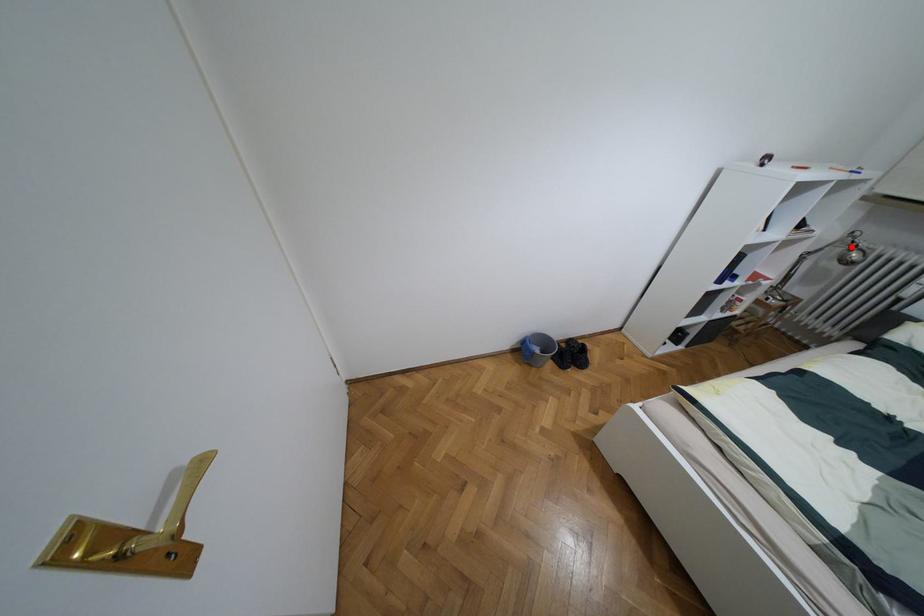
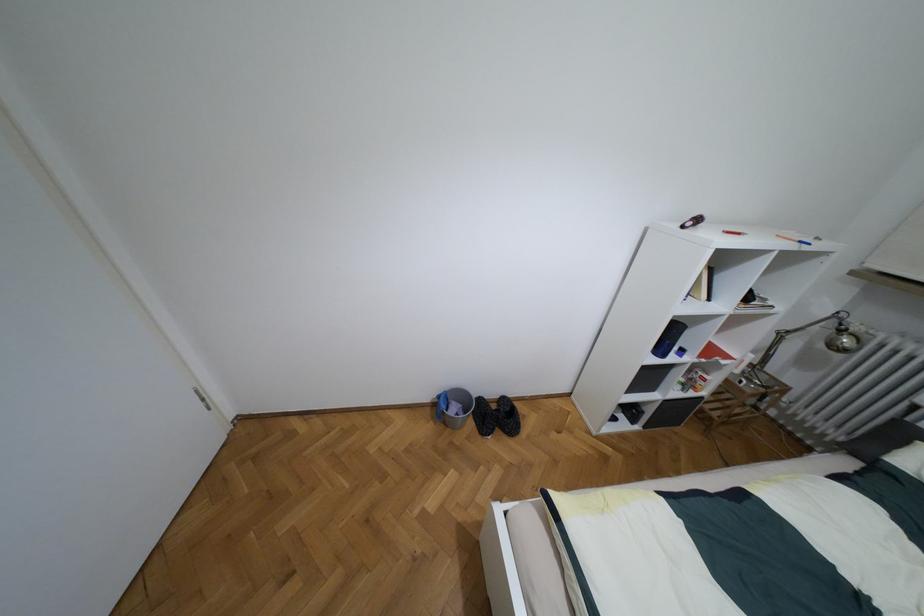
Where in the second image is the point corresponding to the highlighted location from the first image?

(840, 330)